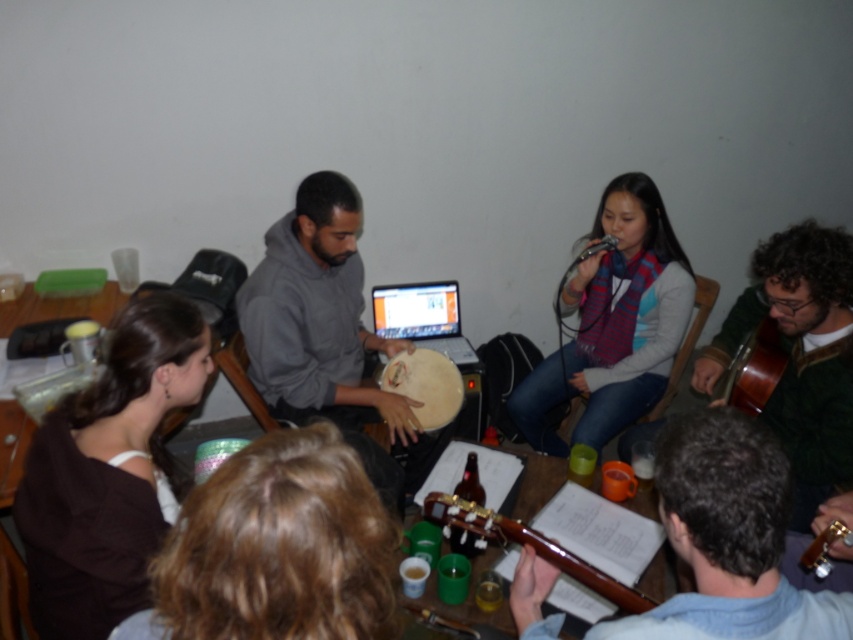
You are setting up a music stand between the wooden acoustic guitar at lower center and the brown wooden guitar at right. Which guitar should the stand be placed closer to if you want it to be near the wider instrument?

The wooden acoustic guitar at lower center might be wider than brown wooden guitar at right, so the music stand should be placed closer to the wooden acoustic guitar at lower center.

You are standing in the room and want to pick up the brown leather guitar at lower center and the wooden table at lower left. Which object is easier to reach without moving your current position?

The brown leather guitar at lower center is closer to the viewer, so it is easier to reach without moving your current position.